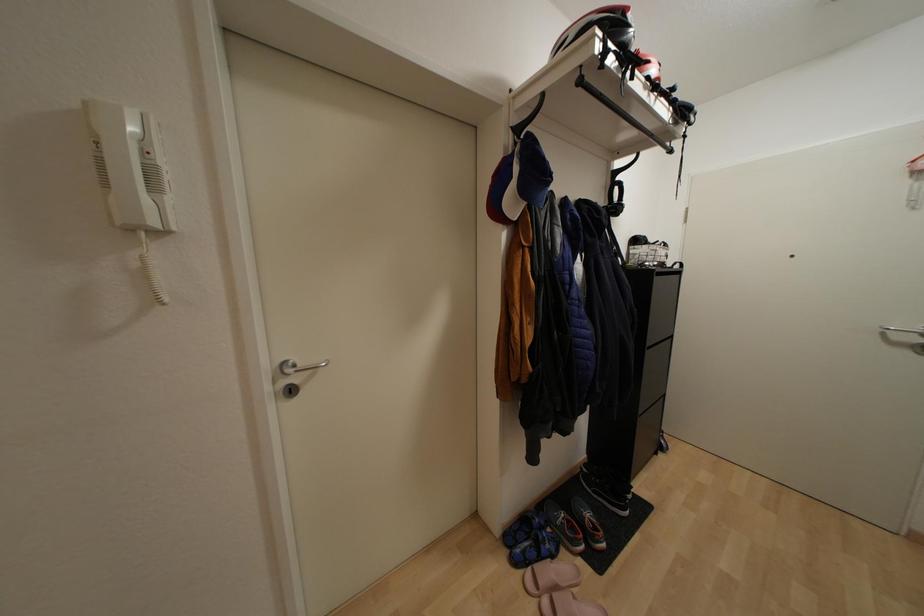
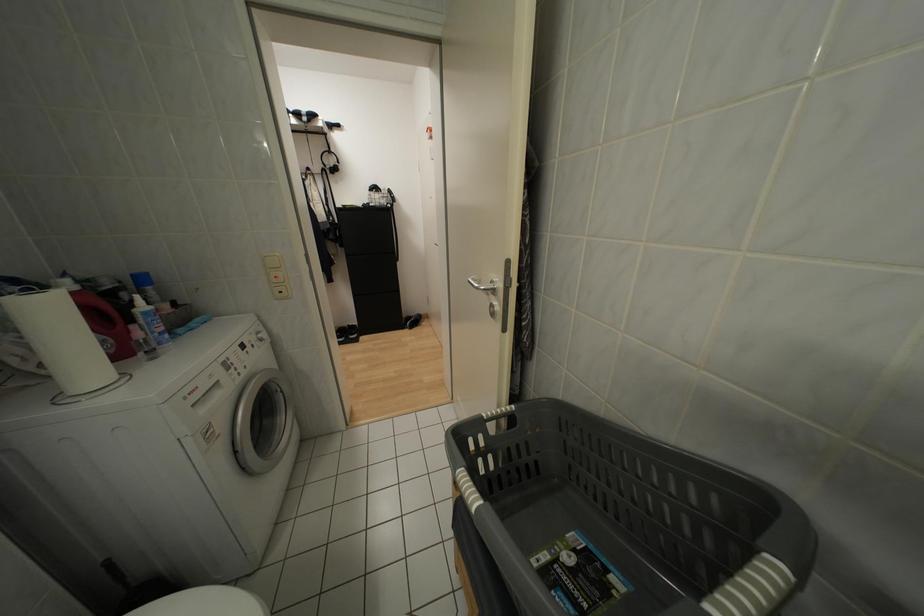
Question: The images are taken continuously from a first-person perspective. In which direction are you moving?

Choices:
 (A) Left
 (B) Right
 (C) Forward
 (D) Backward

Answer: (B)